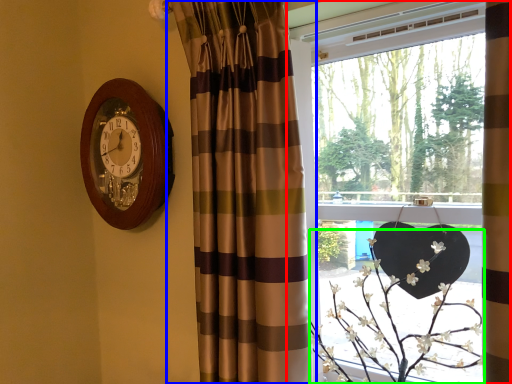
Question: Considering the real-world distances, which object is farthest from window (highlighted by a red box)? curtain (highlighted by a blue box) or floral arrangement (highlighted by a green box)?

Choices:
 (A) curtain
 (B) floral arrangement

Answer: (A)